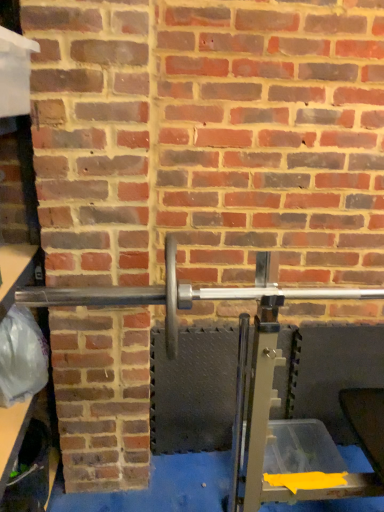
Where is `polished silver barbell at center`? The image size is (384, 512). polished silver barbell at center is located at coordinates (183, 294).

The width and height of the screenshot is (384, 512). What do you see at coordinates (183, 294) in the screenshot?
I see `polished silver barbell at center` at bounding box center [183, 294].

I want to click on polished silver barbell at center, so click(183, 294).